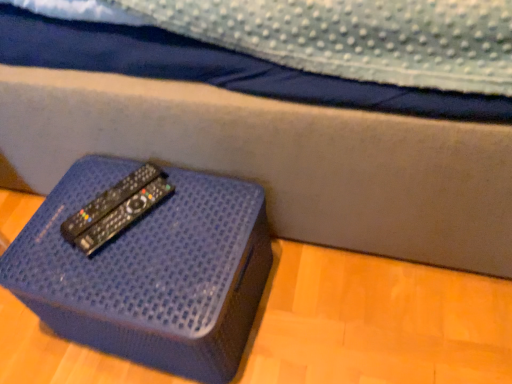
This screenshot has height=384, width=512. What do you see at coordinates (150, 271) in the screenshot?
I see `blue textured box at lower left` at bounding box center [150, 271].

The width and height of the screenshot is (512, 384). I want to click on blue textured box at lower left, so click(150, 271).

What is the approximate height of blue textured box at lower left?

blue textured box at lower left is 9.76 inches in height.

The image size is (512, 384). Describe the element at coordinates (108, 201) in the screenshot. I see `black plastic remote at center` at that location.

Where is `black plastic remote at center`? The height and width of the screenshot is (384, 512). black plastic remote at center is located at coordinates (108, 201).

What is the approximate width of black plastic remote at center?

22.93 centimeters.

The height and width of the screenshot is (384, 512). Identify the location of blue textured box at lower left. (150, 271).

Which is more to the right, black plastic remote at center or blue textured box at lower left?

Positioned to the right is blue textured box at lower left.

Considering the positions of objects black plastic remote at center and blue textured box at lower left in the image provided, who is in front, black plastic remote at center or blue textured box at lower left?

blue textured box at lower left is in front.

Does point (106, 210) come closer to viewer compared to point (104, 254)?

No, (106, 210) is behind (104, 254).

From the image's perspective, is black plastic remote at center positioned above or below blue textured box at lower left?

Clearly, from the image's perspective, black plastic remote at center is above blue textured box at lower left.

From a real-world perspective, is black plastic remote at center over blue textured box at lower left?

Yes, from a real-world perspective, black plastic remote at center is over blue textured box at lower left

Considering the sizes of objects black plastic remote at center and blue textured box at lower left in the image provided, who is wider, black plastic remote at center or blue textured box at lower left?

blue textured box at lower left.

From the picture: From their relative heights in the image, would you say black plastic remote at center is taller or shorter than blue textured box at lower left?

In the image, black plastic remote at center appears to be shorter than blue textured box at lower left.

Who is bigger, black plastic remote at center or blue textured box at lower left?

With larger size is blue textured box at lower left.

Is black plastic remote at center surrounding blue textured box at lower left?

No, blue textured box at lower left is not surrounded by black plastic remote at center.

Is black plastic remote at center with blue textured box at lower left?

No, black plastic remote at center is not in contact with blue textured box at lower left.

Based on the photo, could you tell me if black plastic remote at center is turned towards blue textured box at lower left?

No.

Find the location of `furniture in front of the black plastic remote at center`. furniture in front of the black plastic remote at center is located at coordinates (150, 271).

Does blue textured box at lower left appear on the right side of black plastic remote at center?

Yes.

Who is more distant, blue textured box at lower left or black plastic remote at center?

Positioned behind is black plastic remote at center.

Considering the positions of points (187, 297) and (77, 233), is point (187, 297) farther from camera compared to point (77, 233)?

No.

From the image's perspective, is blue textured box at lower left located above black plastic remote at center?

No.

From a real-world perspective, which is physically above, blue textured box at lower left or black plastic remote at center?

black plastic remote at center is physically above.

Considering the relative sizes of blue textured box at lower left and black plastic remote at center in the image provided, is blue textured box at lower left thinner than black plastic remote at center?

Incorrect, the width of blue textured box at lower left is not less than that of black plastic remote at center.

Is blue textured box at lower left taller or shorter than black plastic remote at center?

Clearly, blue textured box at lower left is taller compared to black plastic remote at center.

Between blue textured box at lower left and black plastic remote at center, which one has larger size?

blue textured box at lower left is bigger.

Consider the image. Is black plastic remote at center inside blue textured box at lower left?

No, black plastic remote at center is not inside blue textured box at lower left.

In the scene shown: Are blue textured box at lower left and black plastic remote at center beside each other?

blue textured box at lower left and black plastic remote at center are clearly separated.

Is blue textured box at lower left aimed at black plastic remote at center?

No, blue textured box at lower left is not aimed at black plastic remote at center.

How many degrees apart are the facing directions of blue textured box at lower left and black plastic remote at center?

The facing directions of blue textured box at lower left and black plastic remote at center are 28.1 degrees apart.

Measure the distance between blue textured box at lower left and black plastic remote at center.

blue textured box at lower left and black plastic remote at center are 6.33 inches apart from each other.

The image size is (512, 384). What are the coordinates of `remote that appears above the blue textured box at lower left (from the image's perspective)` in the screenshot? It's located at click(x=108, y=201).

You are a GUI agent. You are given a task and a screenshot of the screen. Output one action in this format:
    pyautogui.click(x=<x>, y=<y>)
    Task: Click on the remote located behind the blue textured box at lower left
    The height and width of the screenshot is (384, 512).
    Given the screenshot: What is the action you would take?
    pyautogui.click(x=108, y=201)

Where is `remote on the left of blue textured box at lower left`? remote on the left of blue textured box at lower left is located at coordinates (108, 201).